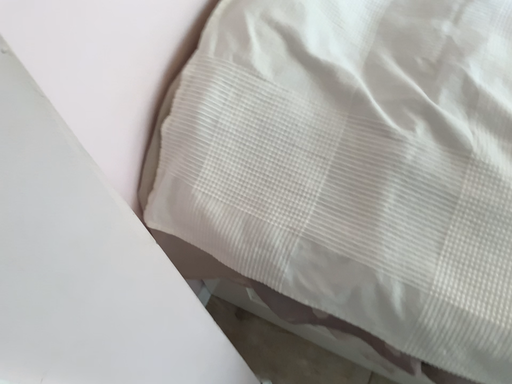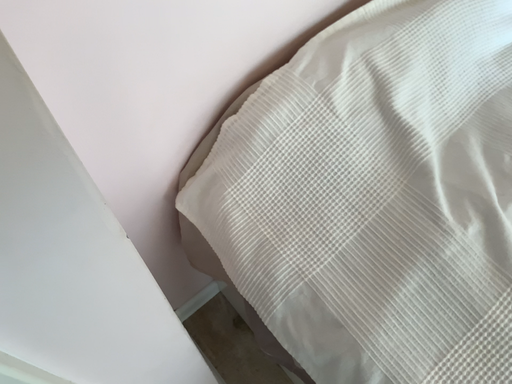
Question: How did the camera likely rotate when shooting the video?

Choices:
 (A) rotated right
 (B) rotated left

Answer: (B)